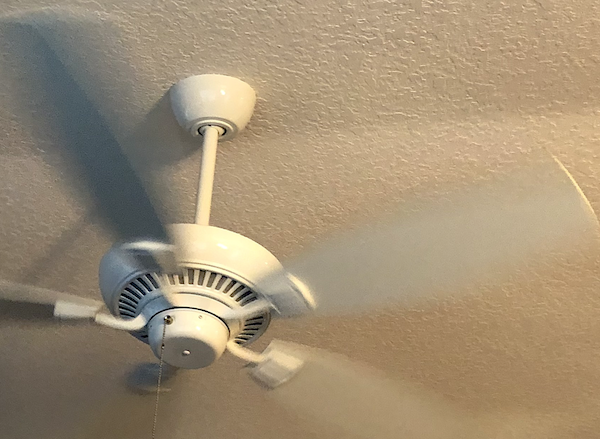
You are a GUI agent. You are given a task and a screenshot of the screen. Output one action in this format:
    pyautogui.click(x=<x>, y=<y>)
    Task: Click on the fan blade edge in shadow
    Image resolution: width=600 pixels, height=439 pixels.
    Given the screenshot: What is the action you would take?
    pyautogui.click(x=70, y=103), pyautogui.click(x=103, y=172), pyautogui.click(x=128, y=215), pyautogui.click(x=41, y=315), pyautogui.click(x=20, y=311)